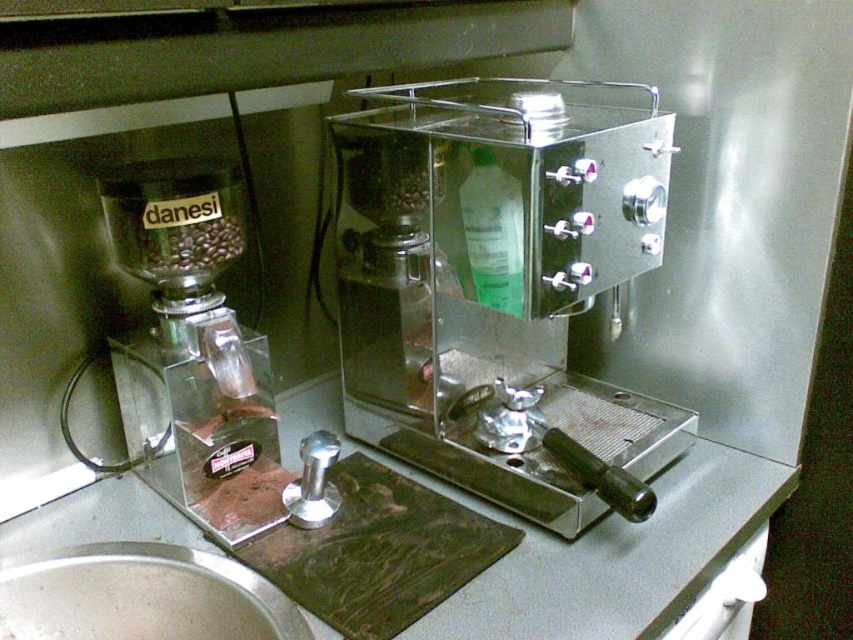
Is matte black grinder at left in front of silver metallic sink at lower left?

No, it is behind silver metallic sink at lower left.

Who is positioned more to the right, matte black grinder at left or silver metallic sink at lower left?

Positioned to the right is silver metallic sink at lower left.

This screenshot has height=640, width=853. I want to click on matte black grinder at left, so click(199, 340).

Identify the location of matte black grinder at left. The width and height of the screenshot is (853, 640). (199, 340).

From the picture: Is polished stainless steel espresso machine at center shorter than silver metallic sink at lower left?

Incorrect, polished stainless steel espresso machine at center's height does not fall short of silver metallic sink at lower left's.

Between point (473, 176) and point (195, 579), which one is positioned behind?

The point (195, 579) is behind.

You are a GUI agent. You are given a task and a screenshot of the screen. Output one action in this format:
    pyautogui.click(x=<x>, y=<y>)
    Task: Click on the polished stainless steel espresso machine at center
    Image resolution: width=853 pixels, height=640 pixels.
    Given the screenshot: What is the action you would take?
    pyautogui.click(x=502, y=285)

Is polished stainless steel espresso machine at center to the left of matte black grinder at left from the viewer's perspective?

Incorrect, polished stainless steel espresso machine at center is not on the left side of matte black grinder at left.

Based on the photo, does polished stainless steel espresso machine at center have a greater height compared to matte black grinder at left?

Indeed, polished stainless steel espresso machine at center has a greater height compared to matte black grinder at left.

You are a GUI agent. You are given a task and a screenshot of the screen. Output one action in this format:
    pyautogui.click(x=<x>, y=<y>)
    Task: Click on the polished stainless steel espresso machine at center
    The width and height of the screenshot is (853, 640).
    Given the screenshot: What is the action you would take?
    pyautogui.click(x=502, y=285)

Where is `polished stainless steel espresso machine at center`? polished stainless steel espresso machine at center is located at coordinates (502, 285).